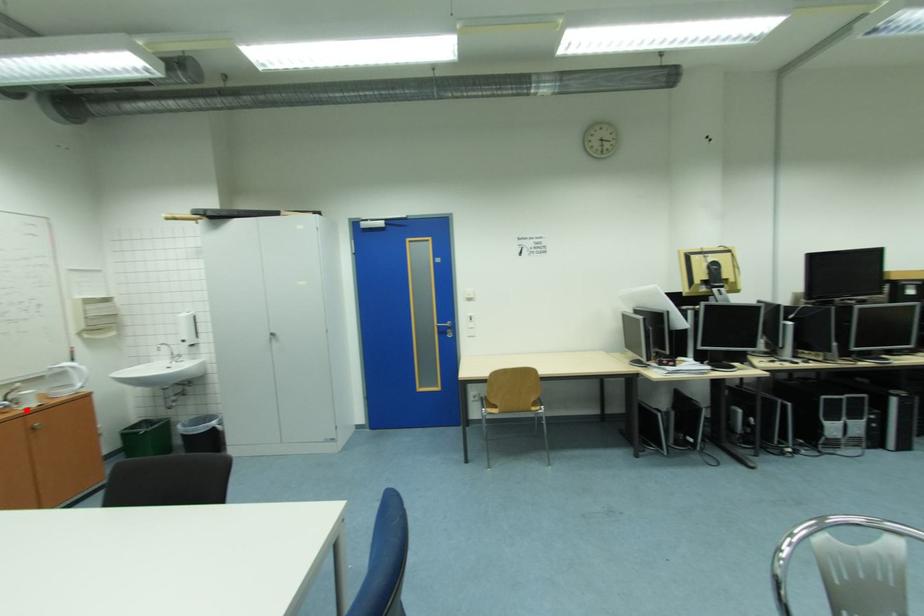
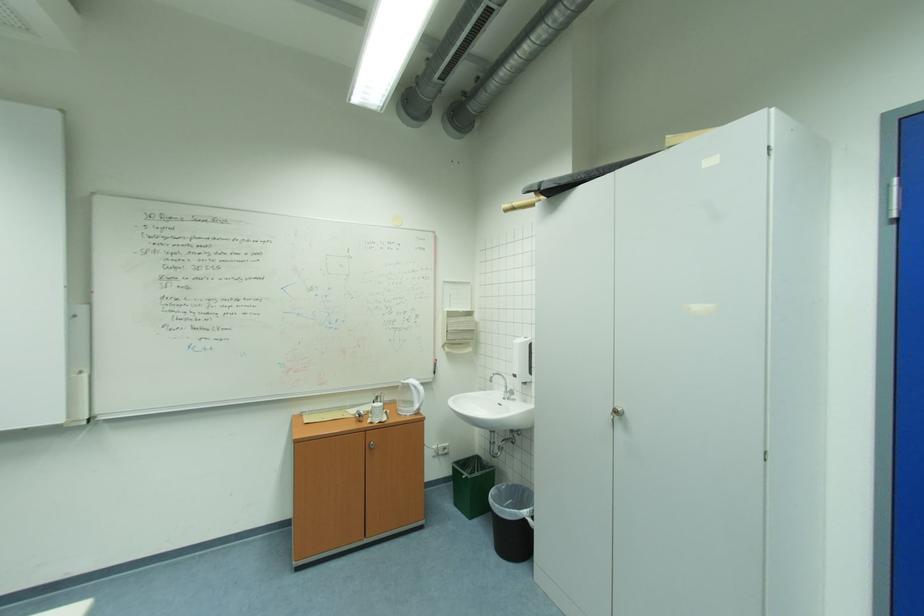
The point at the highlighted location is marked in the first image. Where is the corresponding point in the second image?

(377, 422)